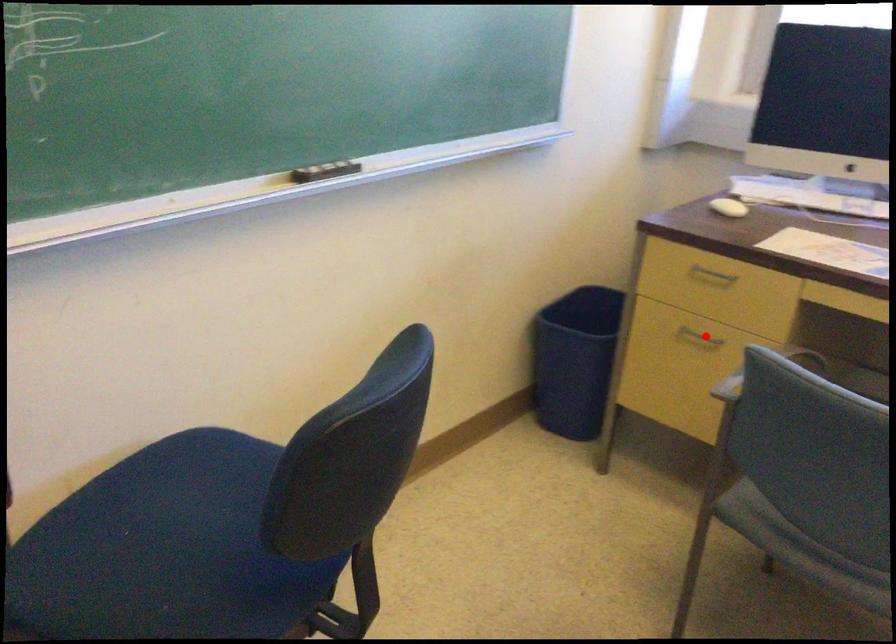
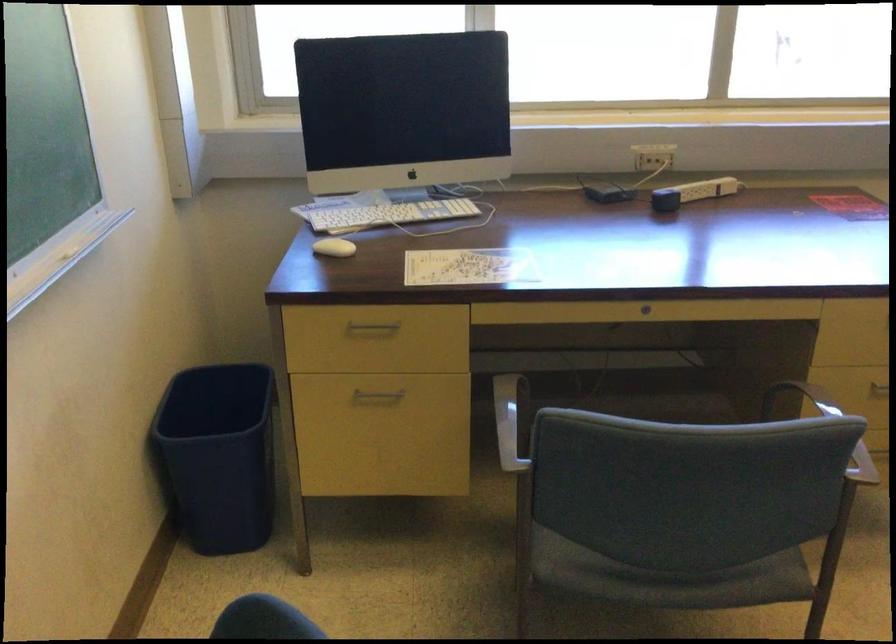
Locate, in the second image, the point that corresponds to the highlighted location in the first image.

(376, 395)